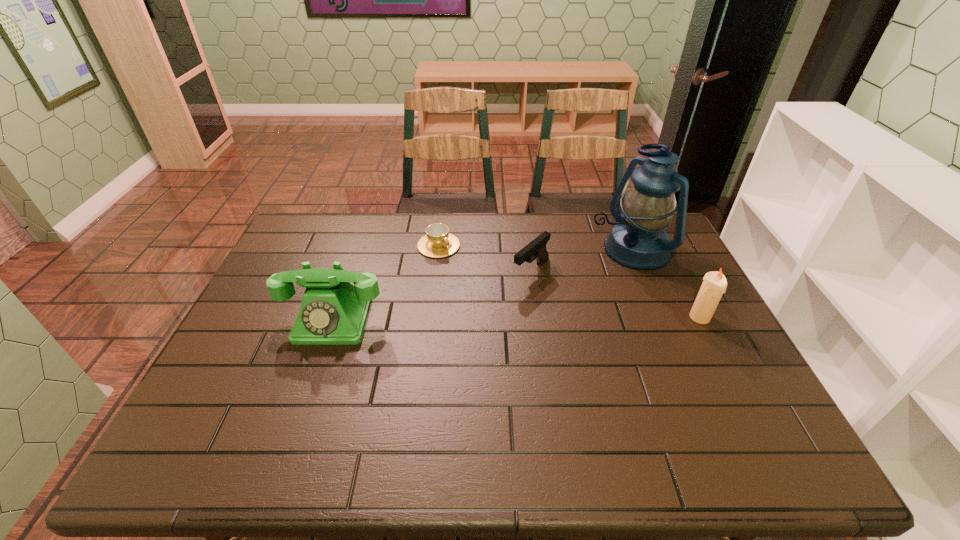
In order to click on free space located with the handle on the side of the fourth object from right to left in this screenshot , I will do `click(466, 268)`.

Locate an element on the screen. Image resolution: width=960 pixels, height=540 pixels. blank area located with the handle on the side of the fourth object from right to left is located at coordinates (509, 305).

Identify the location of vacant region located on the front-facing side of the third object from left to right. point(485,314).

The image size is (960, 540). Find the location of `vacant area situated 0.170m on the front-facing side of the third object from left to right`. vacant area situated 0.170m on the front-facing side of the third object from left to right is located at coordinates (485, 314).

This screenshot has width=960, height=540. Find the location of `free region located on the front-facing side of the third object from left to right`. free region located on the front-facing side of the third object from left to right is located at coordinates (485, 314).

At what (x,y) coordinates should I click in order to perform the action: click on blank space located 0.220m on the face of the lantern. Please return your answer as a coordinate pair (x, y). The height and width of the screenshot is (540, 960). Looking at the image, I should click on (553, 289).

This screenshot has height=540, width=960. Find the location of `free space located on the face of the lantern`. free space located on the face of the lantern is located at coordinates (520, 307).

Where is `vacant space located 0.190m on the face of the lantern`? Image resolution: width=960 pixels, height=540 pixels. vacant space located 0.190m on the face of the lantern is located at coordinates (561, 285).

This screenshot has width=960, height=540. Find the location of `cup that is positioned at the far edge`. cup that is positioned at the far edge is located at coordinates (438, 242).

At what (x,y) coordinates should I click in order to perform the action: click on lantern that is positioned at the far edge. Please return your answer as a coordinate pair (x, y). Image resolution: width=960 pixels, height=540 pixels. Looking at the image, I should click on (638, 240).